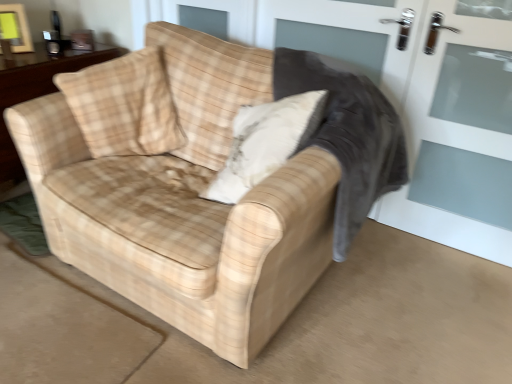
Question: Considering the relative positions of beige plaid throw pillow at upper left, acting as the 2th throw pillow starting from the right, and beige plaid throw pillow at center, placed as the 1th throw pillow when sorted from right to left, in the image provided, is beige plaid throw pillow at upper left, acting as the 2th throw pillow starting from the right, to the right of beige plaid throw pillow at center, placed as the 1th throw pillow when sorted from right to left, from the viewer's perspective?

Choices:
 (A) yes
 (B) no

Answer: (B)

Question: From a real-world perspective, is beige plaid throw pillow at upper left, acting as the 2th throw pillow starting from the right, on top of beige plaid throw pillow at center, which is counted as the second throw pillow, starting from the left?

Choices:
 (A) no
 (B) yes

Answer: (B)

Question: Is beige plaid throw pillow at upper left, acting as the 2th throw pillow starting from the right, not close to beige plaid throw pillow at center, placed as the 1th throw pillow when sorted from right to left?

Choices:
 (A) yes
 (B) no

Answer: (B)

Question: Could you tell me if beige plaid throw pillow at upper left, acting as the 2th throw pillow starting from the right, is facing beige plaid throw pillow at center, placed as the 1th throw pillow when sorted from right to left?

Choices:
 (A) yes
 (B) no

Answer: (B)

Question: Is beige plaid throw pillow at upper left, acting as the 2th throw pillow starting from the right, wider than beige plaid throw pillow at center, placed as the 1th throw pillow when sorted from right to left?

Choices:
 (A) yes
 (B) no

Answer: (B)

Question: Based on their sizes in the image, would you say beige plaid throw pillow at upper left, which ranks as the 1th throw pillow in left-to-right order, is bigger or smaller than plaid fabric rocking chair at center?

Choices:
 (A) big
 (B) small

Answer: (B)

Question: In the image, is beige plaid throw pillow at upper left, which ranks as the 1th throw pillow in left-to-right order, on the left side or the right side of plaid fabric rocking chair at center?

Choices:
 (A) right
 (B) left

Answer: (B)

Question: Considering the positions of beige plaid throw pillow at upper left, which ranks as the 1th throw pillow in left-to-right order, and plaid fabric rocking chair at center in the image, is beige plaid throw pillow at upper left, which ranks as the 1th throw pillow in left-to-right order, wider or thinner than plaid fabric rocking chair at center?

Choices:
 (A) thin
 (B) wide

Answer: (B)

Question: From the image's perspective, is beige plaid throw pillow at upper left, which ranks as the 1th throw pillow in left-to-right order, positioned above or below plaid fabric rocking chair at center?

Choices:
 (A) below
 (B) above

Answer: (A)

Question: Is point (36, 160) closer or farther from the camera than point (507, 175)?

Choices:
 (A) closer
 (B) farther

Answer: (A)

Question: Visually, is beige plaid fabric couch at center positioned to the left or to the right of white glass screen door at right?

Choices:
 (A) left
 (B) right

Answer: (A)

Question: Considering the positions of beige plaid fabric couch at center and white glass screen door at right in the image, is beige plaid fabric couch at center taller or shorter than white glass screen door at right?

Choices:
 (A) tall
 (B) short

Answer: (B)

Question: Is beige plaid fabric couch at center spatially inside white glass screen door at right, or outside of it?

Choices:
 (A) outside
 (B) inside

Answer: (A)

Question: In terms of height, does white glass screen door at right look taller or shorter compared to wooden table at center?

Choices:
 (A) tall
 (B) short

Answer: (A)

Question: Would you say white glass screen door at right is inside or outside wooden table at center?

Choices:
 (A) outside
 (B) inside

Answer: (A)